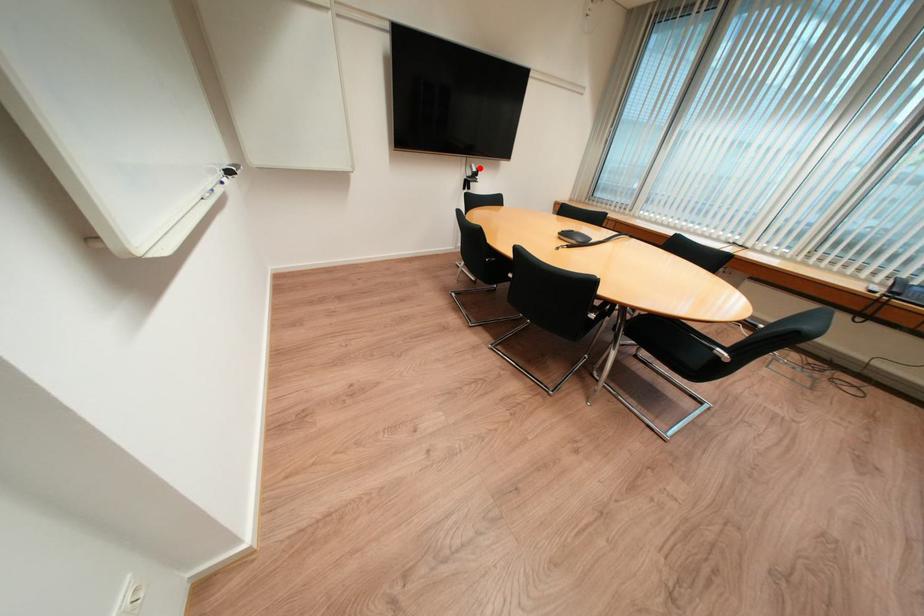
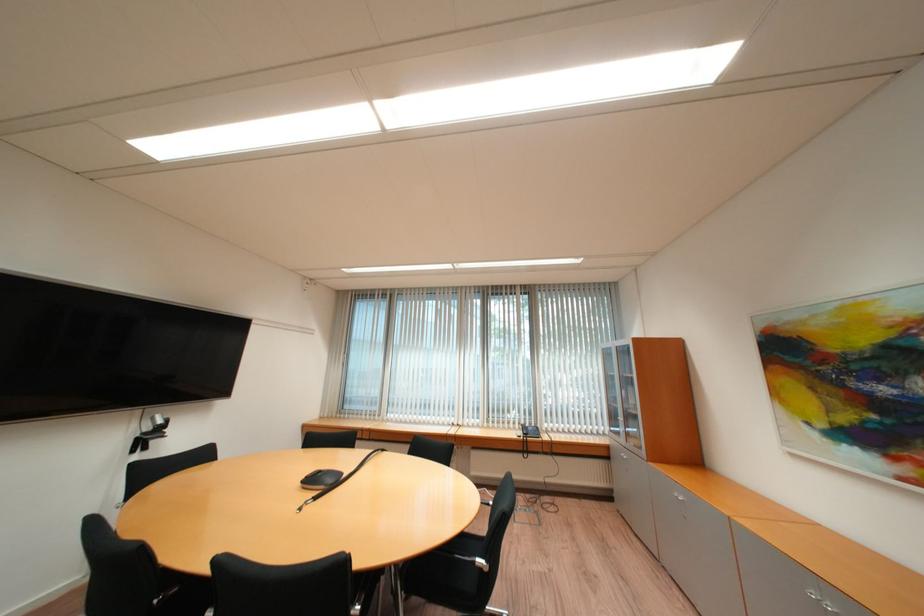
The point at the highlighted location is marked in the first image. Where is the corresponding point in the second image?

(162, 419)